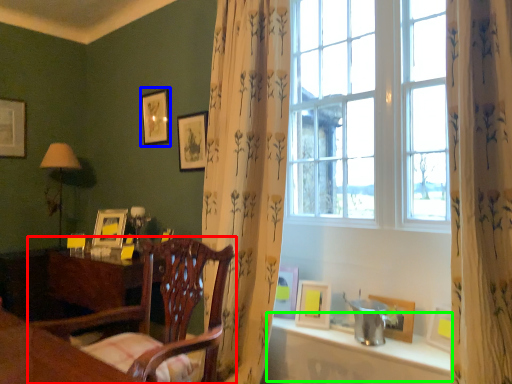
Question: Based on their relative distances, which object is farther from chair (highlighted by a red box)? Choose from picture frame (highlighted by a blue box) and window sill (highlighted by a green box).

Choices:
 (A) picture frame
 (B) window sill

Answer: (A)